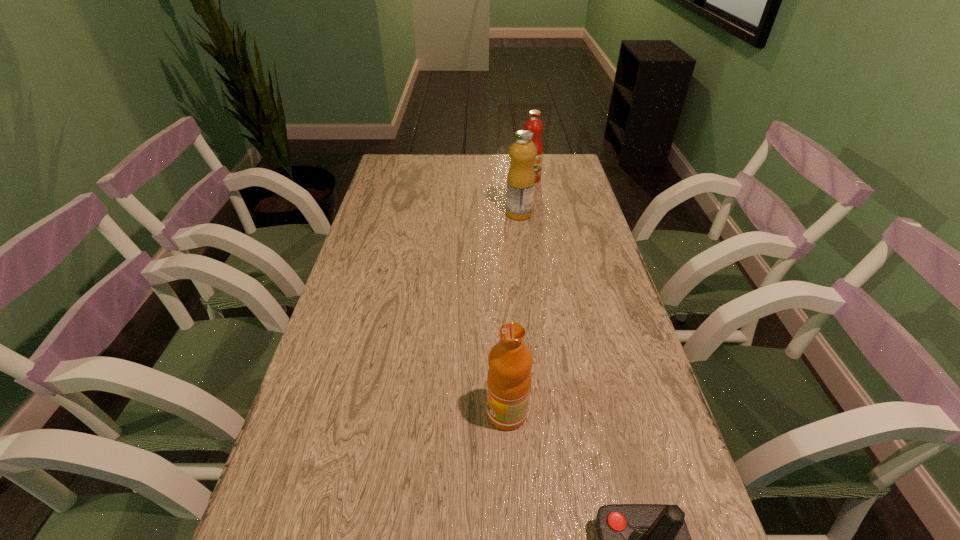
The width and height of the screenshot is (960, 540). I want to click on object positioned at the far edge, so click(x=534, y=124).

Identify the location of object at the right edge. This screenshot has width=960, height=540. (534, 124).

This screenshot has width=960, height=540. What are the coordinates of `object at the far right corner` in the screenshot? It's located at (534, 124).

Identify the location of vacant region at the far edge of the desktop. (482, 179).

What are the coordinates of `vacant space at the left edge of the desktop` in the screenshot? It's located at (326, 440).

You are a GUI agent. You are given a task and a screenshot of the screen. Output one action in this format:
    pyautogui.click(x=<x>, y=<y>)
    Task: Click on the vacant space at the right edge of the desktop
    
    Given the screenshot: What is the action you would take?
    pyautogui.click(x=569, y=254)

At what (x,y) coordinates should I click in order to perform the action: click on vacant space at the far left corner. Please return your answer as a coordinate pair (x, y). The height and width of the screenshot is (540, 960). Looking at the image, I should click on (405, 161).

The image size is (960, 540). Identify the location of vacant region at the far right corner of the desktop. (560, 167).

Locate an element on the screen. This screenshot has height=540, width=960. unoccupied area between the nearest fruit juice and the third nearest object is located at coordinates (513, 313).

This screenshot has width=960, height=540. Find the location of `free space between the second nearest fruit juice and the nearest fruit juice`. free space between the second nearest fruit juice and the nearest fruit juice is located at coordinates (513, 313).